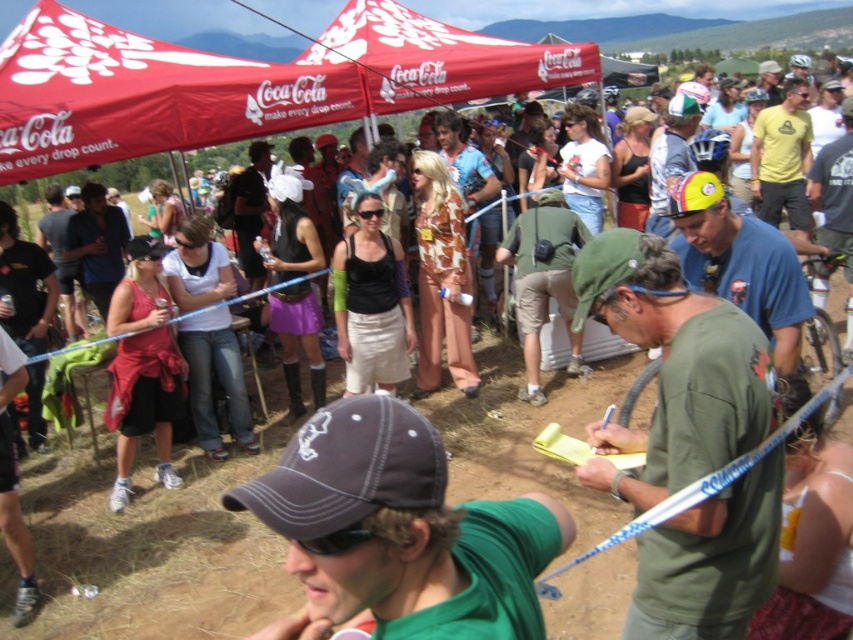
Question: Which point is closer to the camera?

Choices:
 (A) red fabric canopy at upper center
 (B) green matte shirt at center

Answer: (B)

Question: Is red fabric canopy at upper center to the left of green matte shirt at center from the viewer's perspective?

Choices:
 (A) no
 (B) yes

Answer: (B)

Question: Which point is farther from the camera taking this photo?

Choices:
 (A) (196, 140)
 (B) (722, 580)

Answer: (A)

Question: Which object is farther from the camera taking this photo?

Choices:
 (A) green matte shirt at center
 (B) red fabric canopy at upper center

Answer: (B)

Question: Can you confirm if red fabric canopy at upper center is wider than green matte shirt at center?

Choices:
 (A) no
 (B) yes

Answer: (A)

Question: Can you confirm if red fabric canopy at upper center is thinner than green matte shirt at center?

Choices:
 (A) no
 (B) yes

Answer: (B)